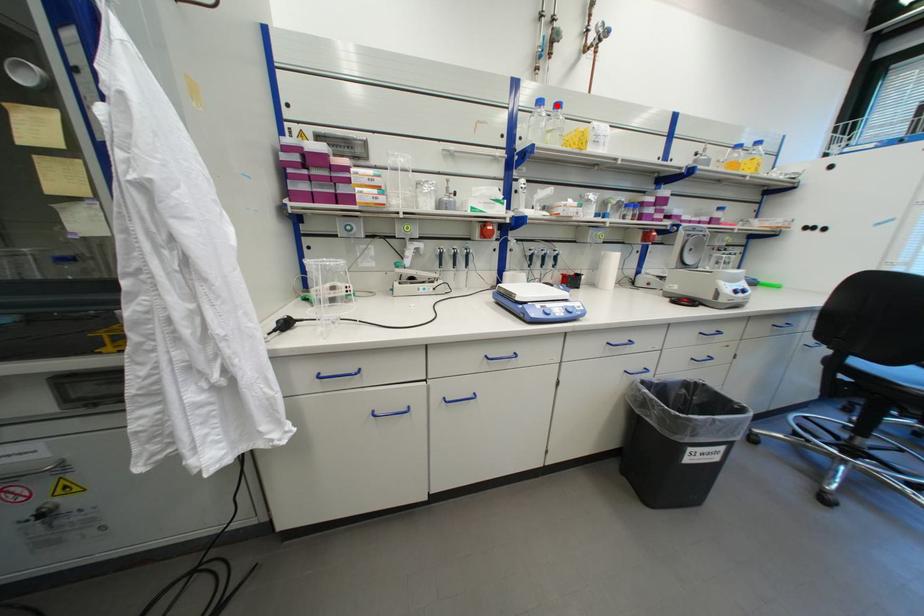
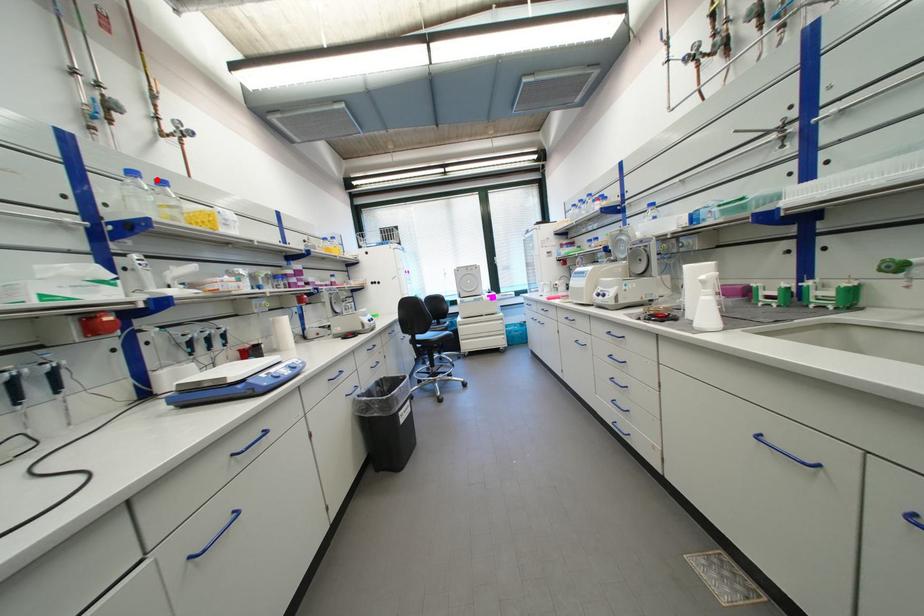
I am providing you with two images of the same scene from different viewpoints. A red point is marked on the first image and another point is marked on the second image. Does the point marked in image1 correspond to the same location as the one in image2?

Yes